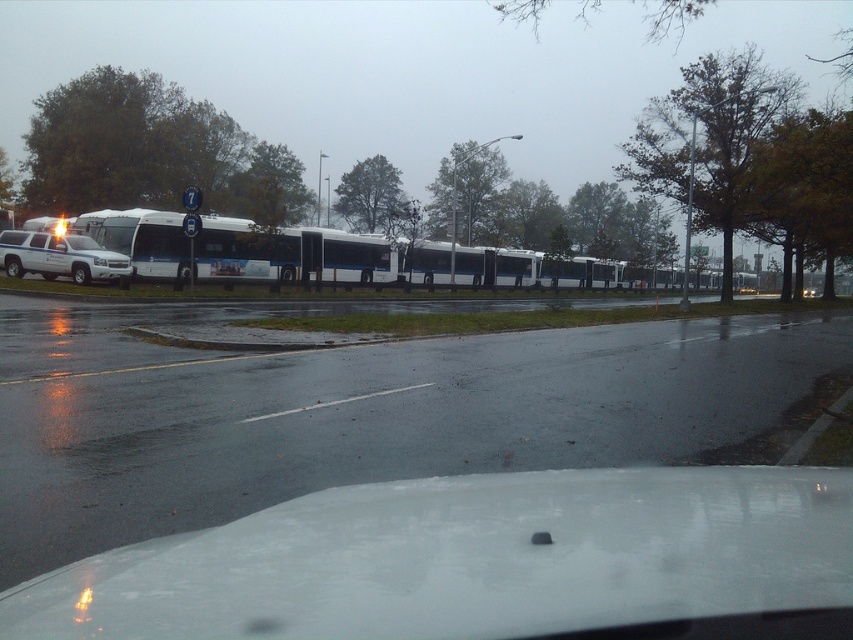
Can you confirm if white matte truck at left is wider than white glossy line at center?

Yes.

Is white matte truck at left thinner than white glossy line at center?

Answer: No.

Between point (125, 276) and point (291, 412), which one is positioned behind?

Point (125, 276)

Where is `white matte truck at left`? This screenshot has width=853, height=640. white matte truck at left is located at coordinates (59, 257).

Is point (289, 602) closer to viewer compared to point (3, 256)?

Yes, it is.

Can you confirm if white glossy car at lower center is positioned above white matte truck at left?

No.

Is point (73, 618) less distant than point (26, 259)?

Yes, it is in front of point (26, 259).

This screenshot has width=853, height=640. What are the coordinates of `white glossy car at lower center` in the screenshot? It's located at coord(469,560).

Is the position of white glossy car at lower center more distant than that of white glossy line at center?

No, it is in front of white glossy line at center.

Describe the element at coordinates (469, 560) in the screenshot. I see `white glossy car at lower center` at that location.

This screenshot has width=853, height=640. Find the location of `white glossy car at lower center`. white glossy car at lower center is located at coordinates (469, 560).